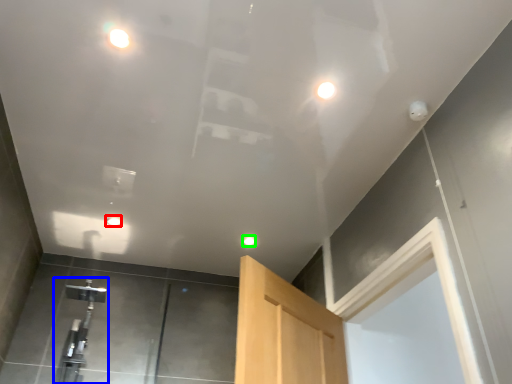
Question: Based on their relative distances, which object is nearer to droplight (highlighted by a red box)? Choose from faucet (highlighted by a blue box) and droplight (highlighted by a green box).

Choices:
 (A) faucet
 (B) droplight

Answer: (A)